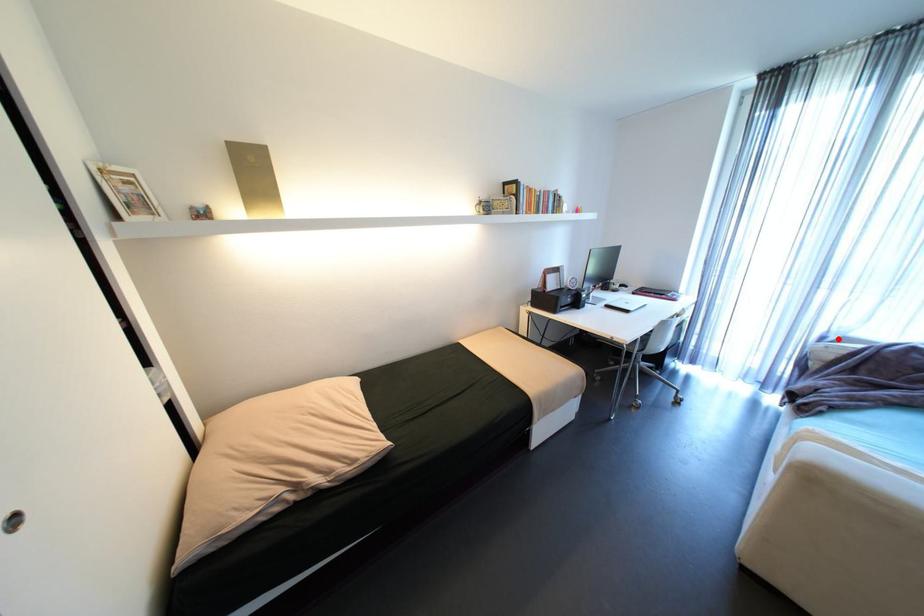
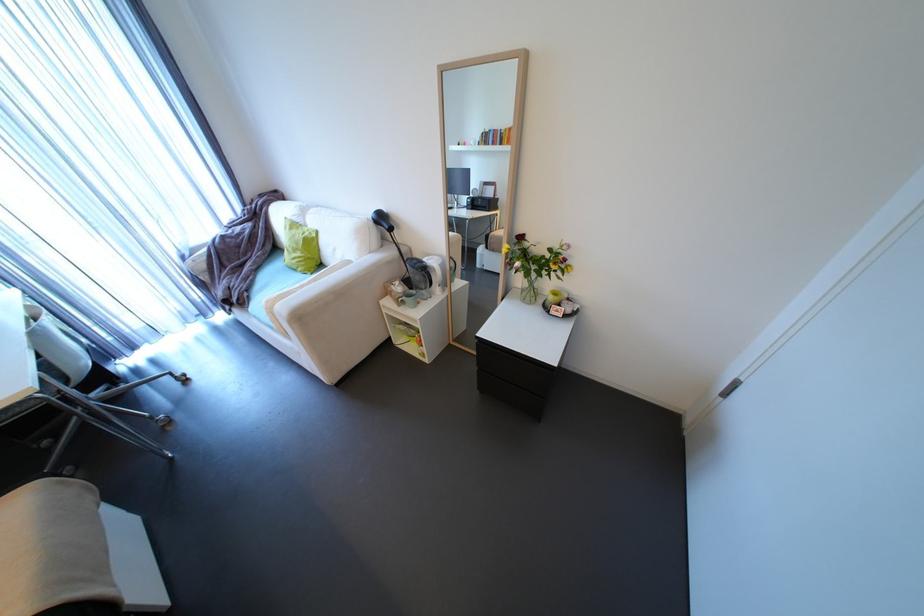
Question: I am providing you with two images of the same scene from different viewpoints. A red point is shown in image1. For the corresponding object point in image2, is it positioned nearer or farther from the camera?

Choices:
 (A) Nearer
 (B) Farther

Answer: (A)